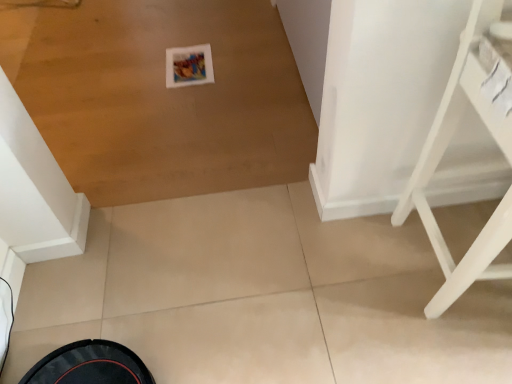
The image size is (512, 384). I want to click on vacant space positioned to the left of white wood ladder at right, so click(344, 291).